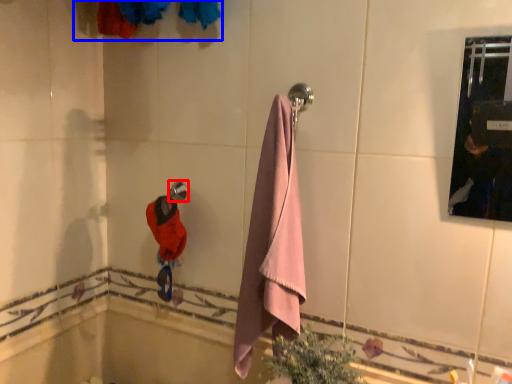
Question: Among these objects, which one is nearest to the camera, towel bar (highlighted by a red box) or laundry (highlighted by a blue box)?

Choices:
 (A) towel bar
 (B) laundry

Answer: (B)